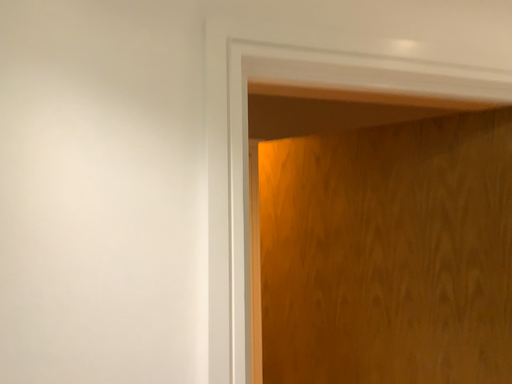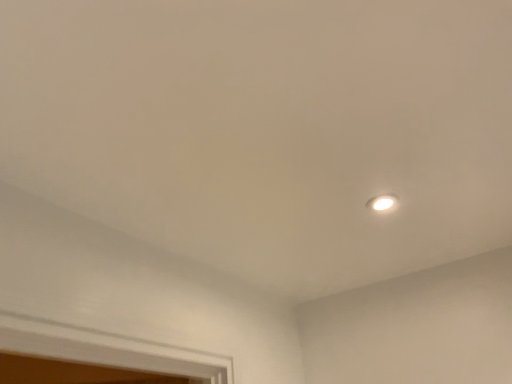
Question: How did the camera likely rotate when shooting the video?

Choices:
 (A) rotated left
 (B) rotated right

Answer: (B)